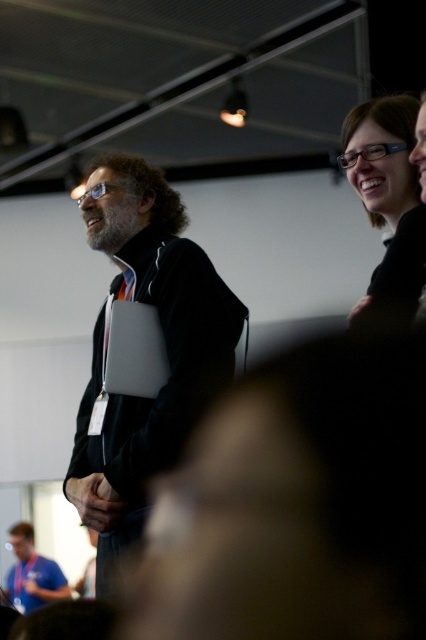
Who is lower down, black matte jacket at center or matte black glasses at upper right?

black matte jacket at center is lower down.

Locate an element on the screen. The width and height of the screenshot is (426, 640). black matte jacket at center is located at coordinates (166, 348).

Where is `black matte jacket at center`? The image size is (426, 640). black matte jacket at center is located at coordinates (166, 348).

Consider the image. Who is higher up, black matte jacket at center or blue fabric shirt at lower left?

black matte jacket at center

Is the position of black matte jacket at center more distant than that of blue fabric shirt at lower left?

No.

Does point (120, 209) come in front of point (37, 577)?

Yes.

The width and height of the screenshot is (426, 640). I want to click on black matte jacket at center, so click(166, 348).

Is matte black glasses at upper right behind blue fabric shirt at lower left?

That is False.

Is matte black glasses at upper right taller than blue fabric shirt at lower left?

In fact, matte black glasses at upper right may be shorter than blue fabric shirt at lower left.

Is point (380, 132) farther from viewer compared to point (23, 577)?

No, (380, 132) is closer to viewer.

This screenshot has height=640, width=426. Identify the location of matte black glasses at upper right. [x=389, y=202].